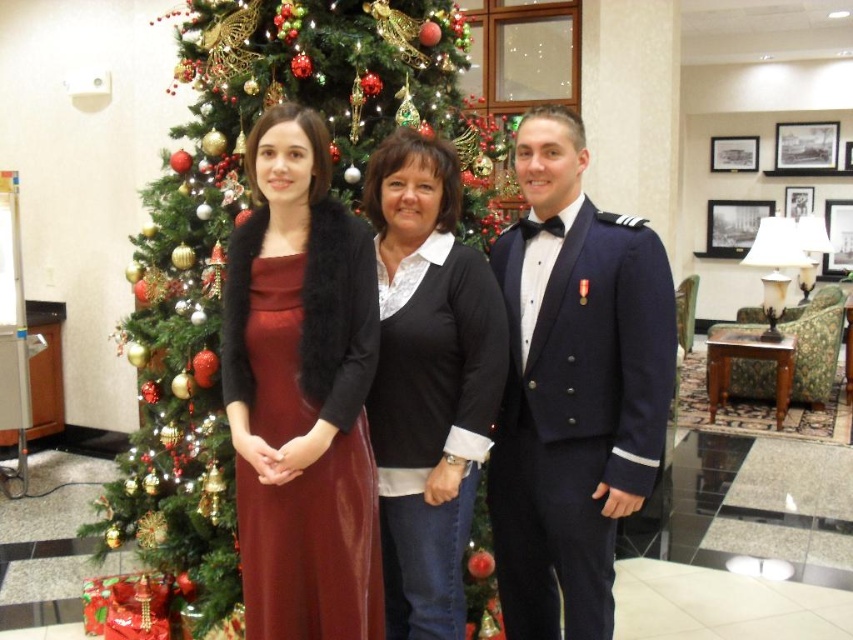
Question: Can you confirm if matte black dress at center is wider than black sweater at center?

Choices:
 (A) yes
 (B) no

Answer: (A)

Question: Does velvet burgundy dress at left appear on the left side of black sweater at center?

Choices:
 (A) yes
 (B) no

Answer: (A)

Question: Estimate the real-world distances between objects in this image. Which object is farther from the black sweater at center?

Choices:
 (A) decorated christmas tree at center
 (B) velvet burgundy dress at left
 (C) navy blue uniform at center

Answer: (A)

Question: Can you confirm if velvet burgundy dress at left is wider than black sweater at center?

Choices:
 (A) yes
 (B) no

Answer: (A)

Question: Which point is farther to the camera?

Choices:
 (A) click(415, 188)
 (B) click(639, 461)

Answer: (A)

Question: Which point is farther to the camera?

Choices:
 (A) velvet burgundy dress at left
 (B) matte black dress at center
 (C) decorated christmas tree at center

Answer: (C)